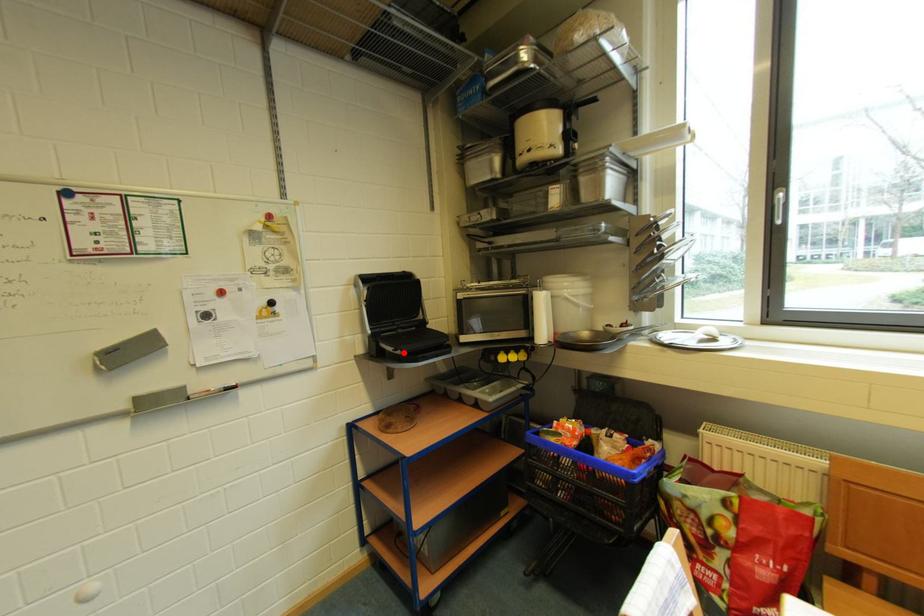
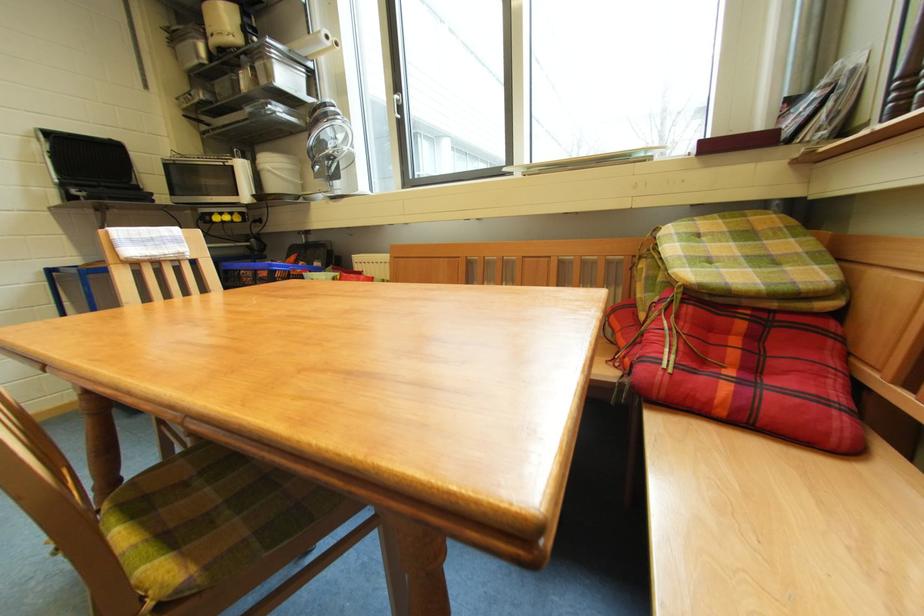
Question: I am providing you with two images of the same scene from different viewpoints. A red point is shown in image1. For the corresponding object point in image2, is it positioned nearer or farther from the camera?

Choices:
 (A) Nearer
 (B) Farther

Answer: (B)